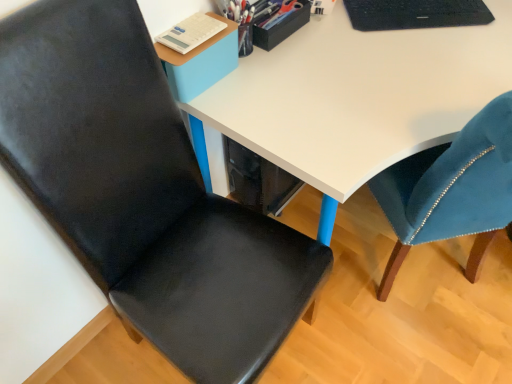
At what (x,y) coordinates should I click in order to perform the action: click on free space above white glossy desk at center (from a real-world perspective). Please return your answer as a coordinate pair (x, y). The image size is (512, 384). Looking at the image, I should click on (395, 73).